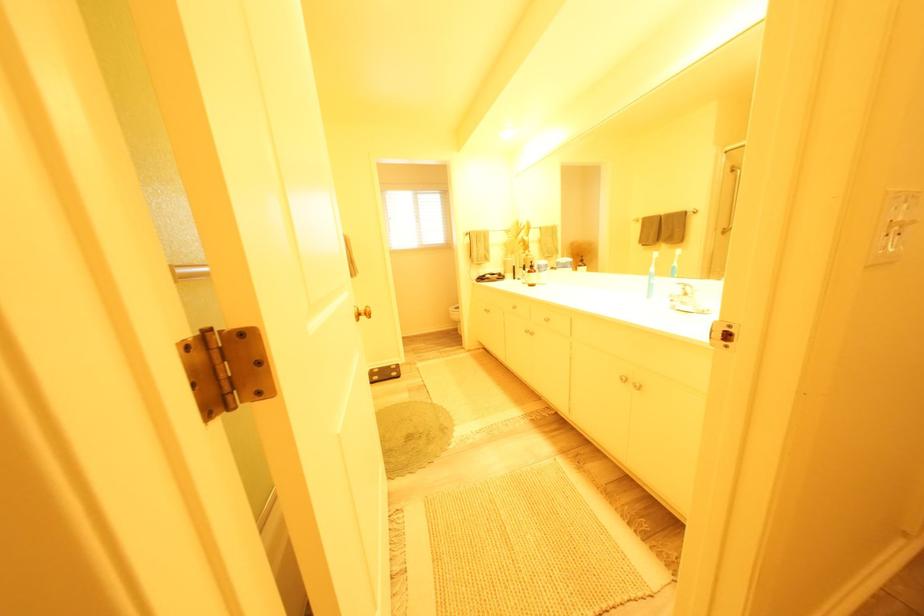
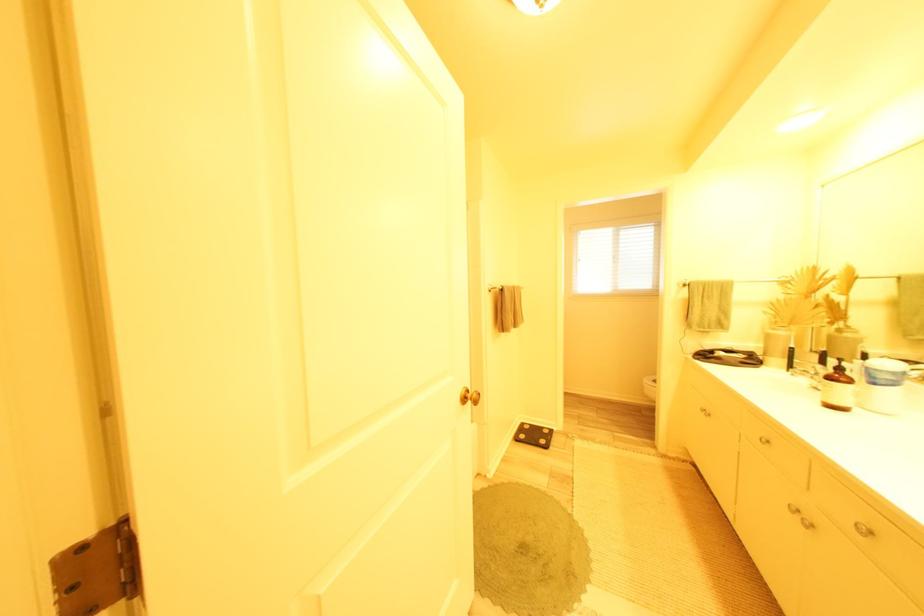
Question: Based on the continuous images, in which direction is the camera rotating? Reply with the corresponding letter.

Choices:
 (A) Left
 (B) Right
 (C) Up
 (D) Down

Answer: (A)